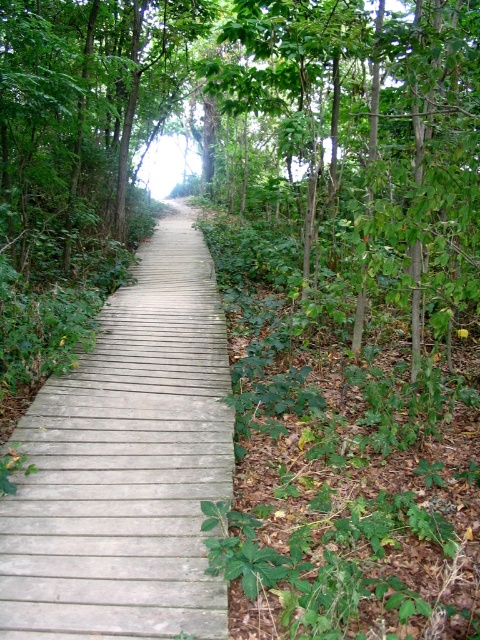
In the scene shown: Does wooden planks at center have a lesser height compared to green leafy tree at center?

Indeed, wooden planks at center has a lesser height compared to green leafy tree at center.

Which is behind, point (98, 516) or point (356, 33)?

The point (356, 33) is more distant.

Is point (183, 406) closer to viewer compared to point (382, 112)?

Yes, it is.

Locate an element on the screen. wooden planks at center is located at coordinates (128, 464).